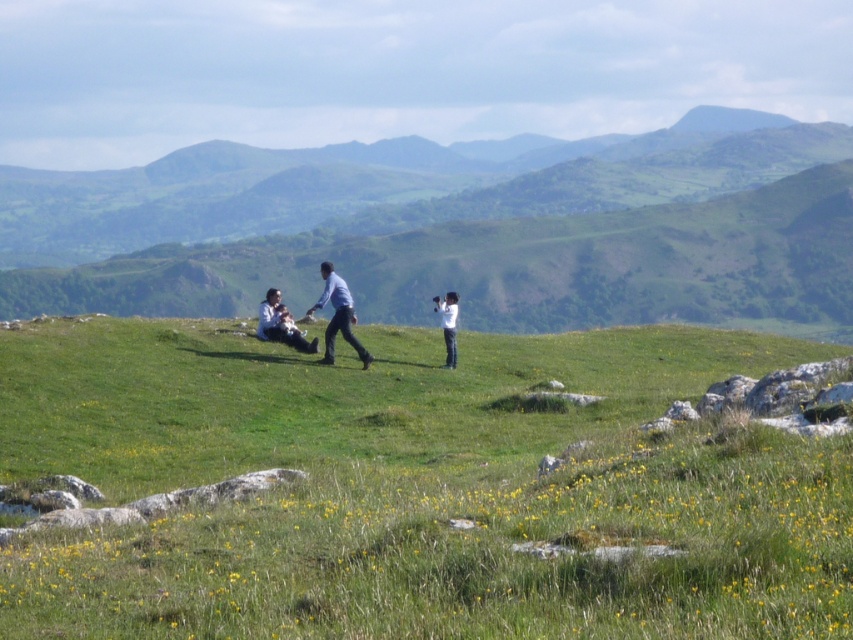
You are a photographer standing at the edge of the green grassy field at center. You want to place your white matte camera at center exactly 10 meters away from the field. Is the current placement of the camera at 8.64 meters sufficient?

The white matte camera at center is currently placed 8.64 meters away from the green grassy field at center, which is less than the desired 10 meters. Therefore, the current placement is not sufficient, and you need to move the camera further away by an additional 1.36 meters to reach the required distance.